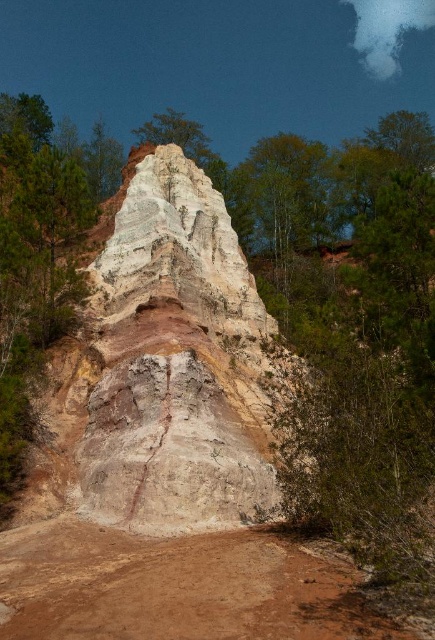
Does smooth sandstone rock at center have a greater height compared to brown sandy dirt track at lower center?

Indeed, smooth sandstone rock at center has a greater height compared to brown sandy dirt track at lower center.

What do you see at coordinates (163, 371) in the screenshot? The height and width of the screenshot is (640, 435). I see `smooth sandstone rock at center` at bounding box center [163, 371].

What are the coordinates of `smooth sandstone rock at center` in the screenshot? It's located at (163, 371).